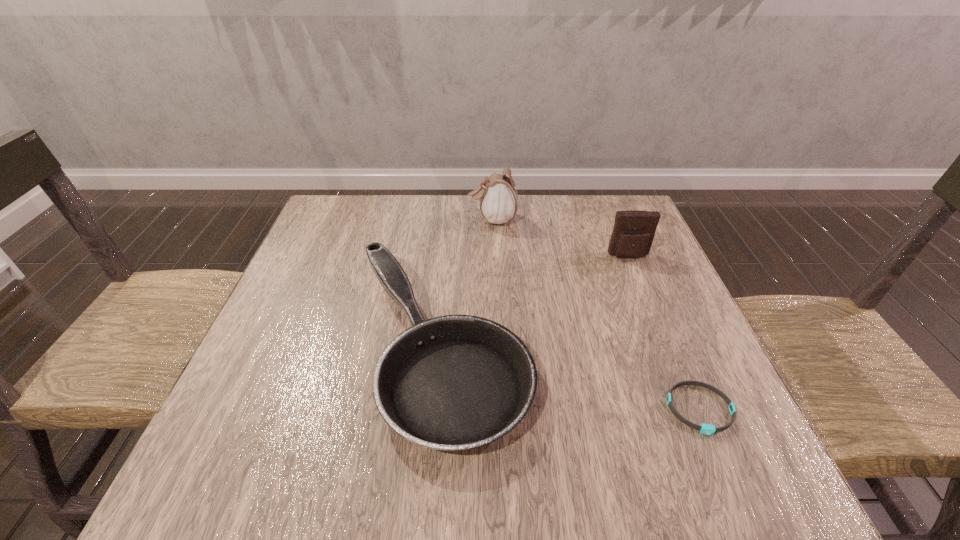
In the image, there is a desktop. Find the location of `blank space at the far right corner`. blank space at the far right corner is located at coordinates (606, 200).

You are a GUI agent. You are given a task and a screenshot of the screen. Output one action in this format:
    pyautogui.click(x=<x>, y=<y>)
    Task: Click on the vacant area at the near right corner of the desktop
    
    Given the screenshot: What is the action you would take?
    coord(721,445)

In order to click on empty space that is in between the second farthest object and the wristband in this screenshot , I will do `click(664, 333)`.

You are a GUI agent. You are given a task and a screenshot of the screen. Output one action in this format:
    pyautogui.click(x=<x>, y=<y>)
    Task: Click on the free space between the second tallest object and the wristband
    The width and height of the screenshot is (960, 540).
    Given the screenshot: What is the action you would take?
    pyautogui.click(x=664, y=333)

The width and height of the screenshot is (960, 540). I want to click on unoccupied position between the wristband and the frying pan, so click(x=570, y=379).

Find the location of a particular element. Image resolution: width=960 pixels, height=540 pixels. vacant space that is in between the frying pan and the wristband is located at coordinates (570, 379).

Where is `empty location between the wristband and the second shortest object`? Image resolution: width=960 pixels, height=540 pixels. empty location between the wristband and the second shortest object is located at coordinates (570, 379).

At what (x,y) coordinates should I click in order to perform the action: click on blank region between the left pouch and the frying pan. Please return your answer as a coordinate pair (x, y). This screenshot has width=960, height=540. Looking at the image, I should click on (467, 284).

This screenshot has width=960, height=540. I want to click on empty space that is in between the wristband and the right pouch, so click(664, 333).

Locate an element on the screen. This screenshot has height=540, width=960. free space between the farther pouch and the third tallest object is located at coordinates (467, 284).